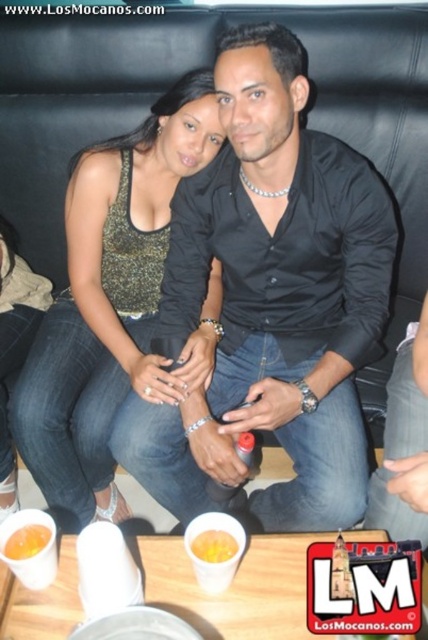
You are a photographer standing at the camera position. You want to capture a closeup shot of the shiny gold tank top at center. Based on the scene description, can you determine if you need to move closer or farther away from the current position to achieve this?

The shiny gold tank top at center is 1.19 meters away from the camera. To capture a closeup shot, you would need to move closer to reduce the distance, so moving closer is necessary.

You are a photographer trying to capture a closeup of the shiny gold tank top at center and the yellow matte cup at center. Since you want both items to appear the same size in the photo, which object should you move closer to the camera?

Since the shiny gold tank top at center is bigger than the yellow matte cup at center, you should move the yellow matte cup at center closer to the camera to make them appear the same size in the photo.